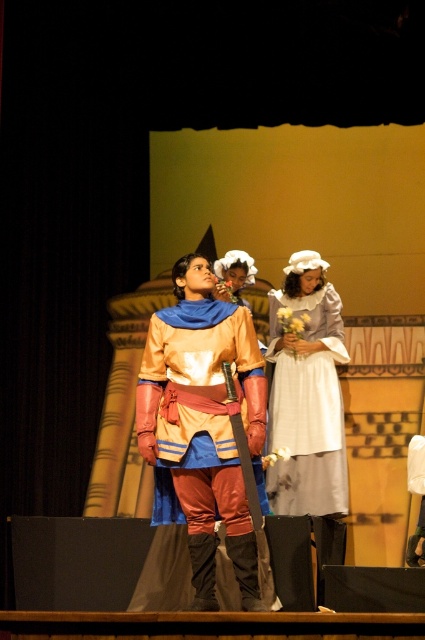
Based on the photo, does matte gold armor at center have a greater width compared to white cotton dress at center?

Correct, the width of matte gold armor at center exceeds that of white cotton dress at center.

Can you confirm if matte gold armor at center is bigger than white cotton dress at center?

No, matte gold armor at center is not bigger than white cotton dress at center.

Is point (227, 531) closer to camera compared to point (322, 284)?

That is True.

The image size is (425, 640). In order to click on matte gold armor at center in this screenshot , I will do `click(201, 412)`.